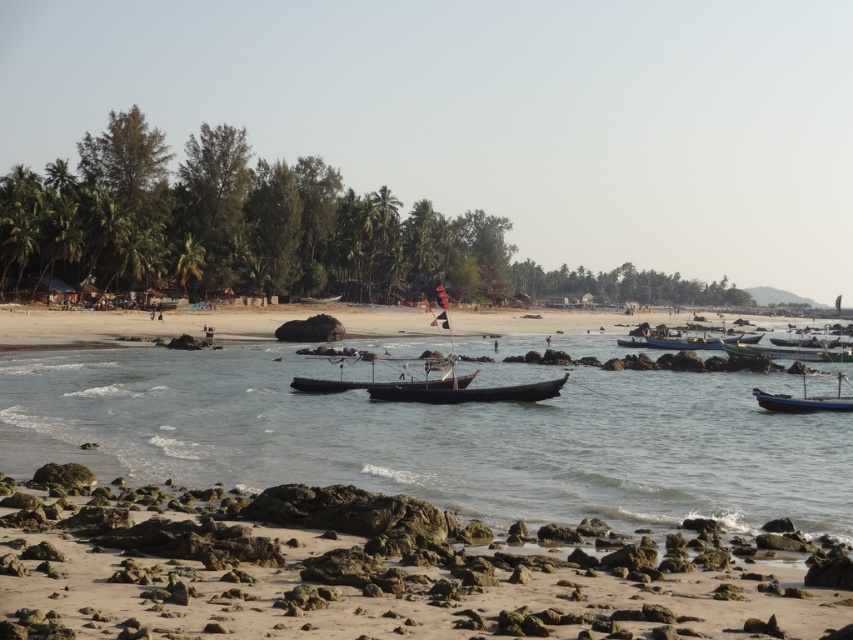
In the scene shown: You are standing on the rocky shoreline in the foreground of the coastal scene. You see the wooden boat at center represented by point (383,381). If you want to reach the boat, which direction should you walk? Please answer with either north, south, east, or west.

The wooden boat at center is located at point (383,381), so you should walk east to reach it.

You are a photographer planning to capture the wooden boat at center and the blue wooden boat at lower right in the same frame. Which boat should you move closer to in order to include both boats clearly in your photo?

Since the wooden boat at center is smaller than the blue wooden boat at lower right, you should move closer to the wooden boat at center to ensure both boats are visible and balanced in the frame.

You are a photographer trying to capture the green wooden boat at right in your shot. You are currently positioned at the center of the image. Which direction should you move your camera to frame the boat?

The green wooden boat at right is located at point 0.550 on the x axis and 0.924 on the y axis. Since you are at the center, which is point 0.5 on both axes, you should move your camera slightly to the right along the x axis and upwards along the y axis to frame the boat.